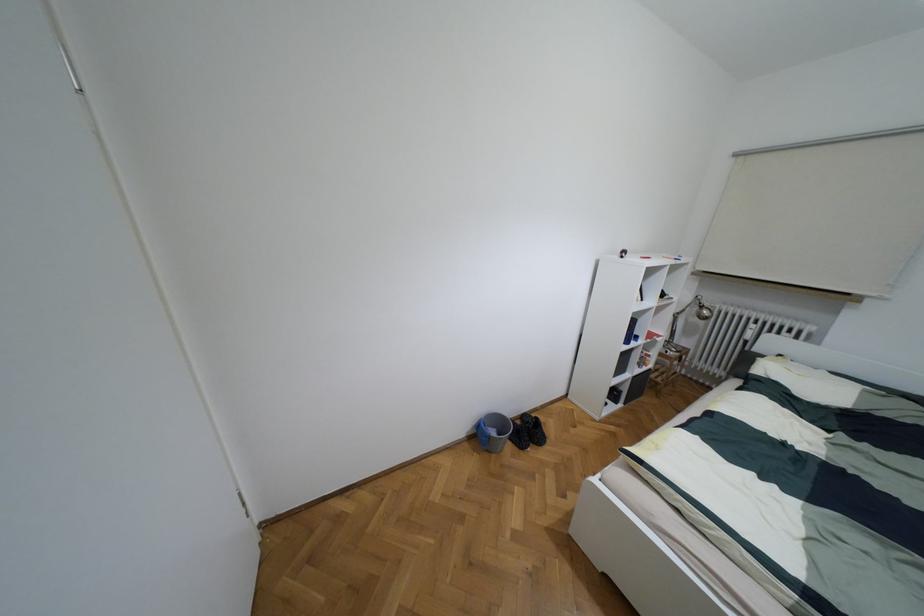
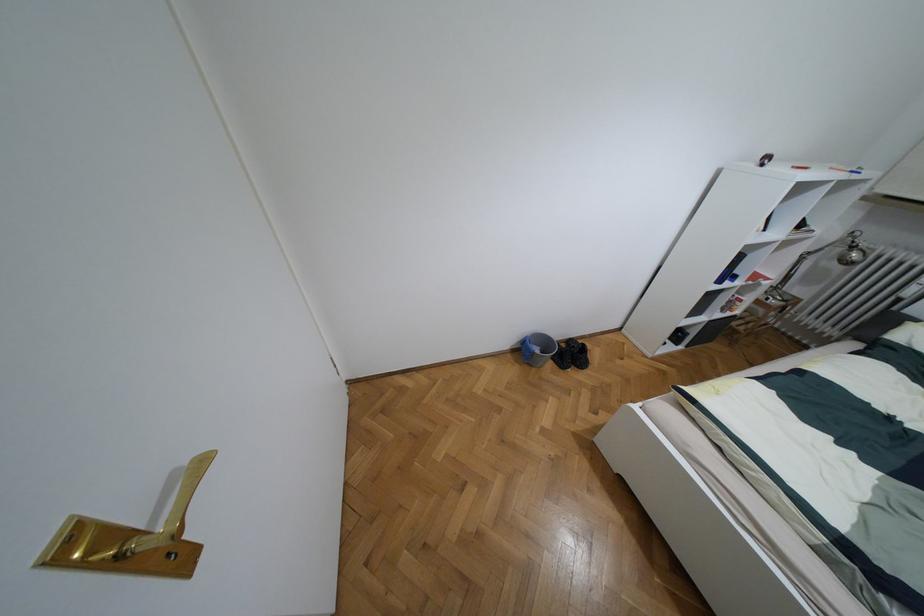
Where in the second image is the point corresponding to point (536, 418) from the first image?

(582, 344)